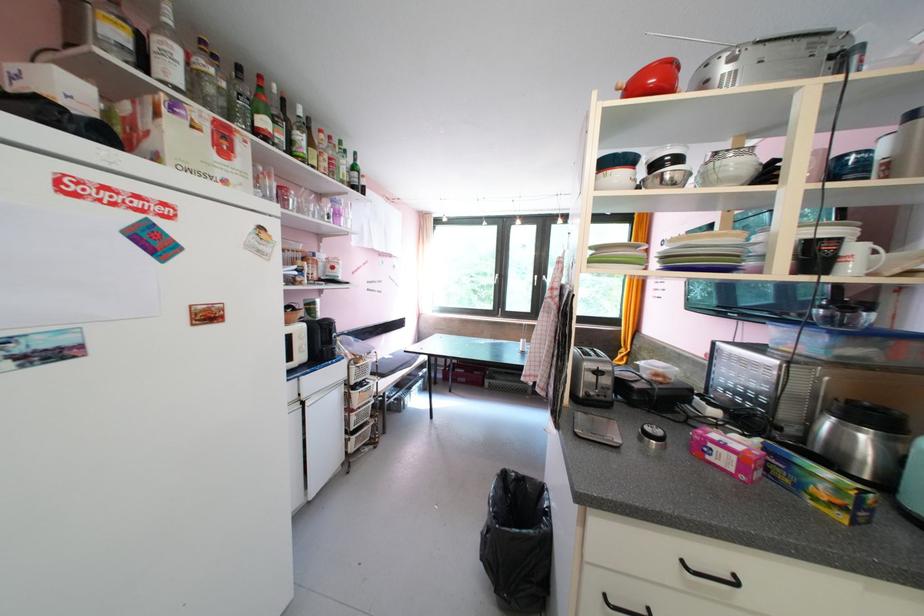
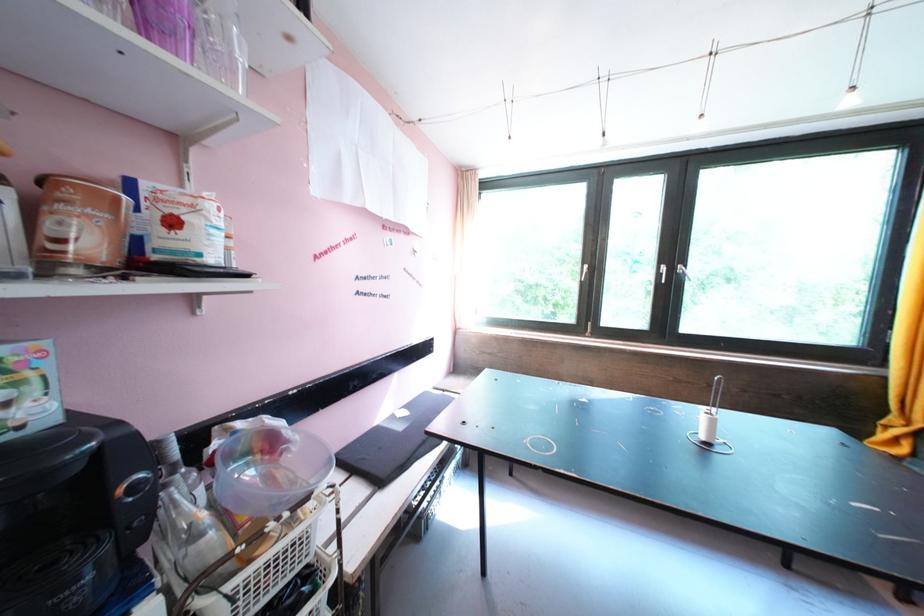
The point at (548, 281) is marked in the first image. Where is the corresponding point in the second image?

(679, 273)